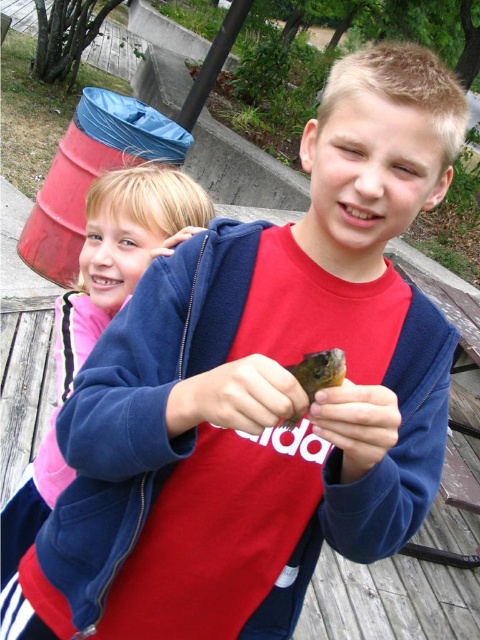
Does blue fleece jacket at upper left appear on the right side of brown matte hand at center?

Answer: Incorrect, blue fleece jacket at upper left is not on the right side of brown matte hand at center.

Who is positioned more to the left, blue fleece jacket at upper left or brown matte hand at center?

blue fleece jacket at upper left

Is point (175, 195) closer to camera compared to point (354, 433)?

No, it is behind (354, 433).

Locate an element on the screen. Image resolution: width=480 pixels, height=640 pixels. blue fleece jacket at upper left is located at coordinates (98, 312).

Which is in front, point (284, 388) or point (324, 422)?

Point (284, 388) is more forward.

Does smooth skin hand at center appear on the right side of brown matte hand at center?

No, smooth skin hand at center is not to the right of brown matte hand at center.

Who is more forward, (261, 422) or (350, 403)?

Positioned in front is point (350, 403).

Where is `smooth skin hand at center`? smooth skin hand at center is located at coordinates (236, 397).

Is brown matte hand at center wider than matte blue sweatshirt at upper left?

No, brown matte hand at center is not wider than matte blue sweatshirt at upper left.

Does point (324, 404) lie in front of point (173, 237)?

Yes, it is in front of point (173, 237).

Which is behind, point (380, 396) or point (156, 250)?

The point (156, 250) is more distant.

Locate an element on the screen. This screenshot has height=640, width=480. brown matte hand at center is located at coordinates (357, 422).